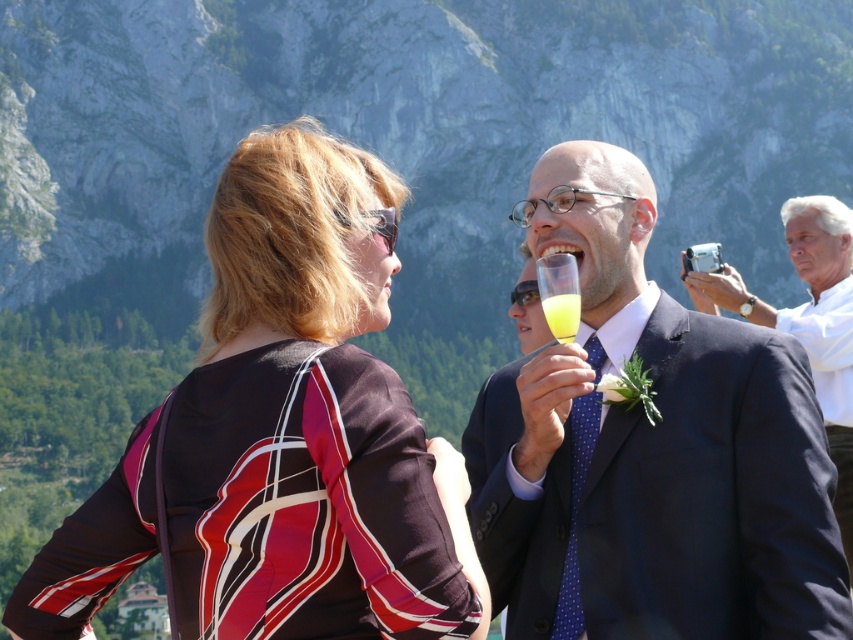
I want to click on matte black suit at center, so pos(648,449).

Can you confirm if matte black suit at center is positioned to the right of white matte suit at upper right?

No, matte black suit at center is not to the right of white matte suit at upper right.

Is point (815, 419) positioned behind point (762, 300)?

No.

Identify the location of matte black suit at center. This screenshot has width=853, height=640. (648, 449).

Which of these two, rocky mountain at upper center or white matte suit at upper right, stands shorter?

Standing shorter between the two is white matte suit at upper right.

Looking at this image, who is lower down, rocky mountain at upper center or white matte suit at upper right?

Positioned lower is white matte suit at upper right.

At what (x,y) coordinates should I click in order to perform the action: click on rocky mountain at upper center. Please return your answer as a coordinate pair (x, y). The width and height of the screenshot is (853, 640). Looking at the image, I should click on (404, 131).

Is rocky mountain at upper center bigger than matte black suit at center?

Yes, rocky mountain at upper center is bigger than matte black suit at center.

Describe the element at coordinates (404, 131) in the screenshot. I see `rocky mountain at upper center` at that location.

Where is `rocky mountain at upper center`? Image resolution: width=853 pixels, height=640 pixels. rocky mountain at upper center is located at coordinates (404, 131).